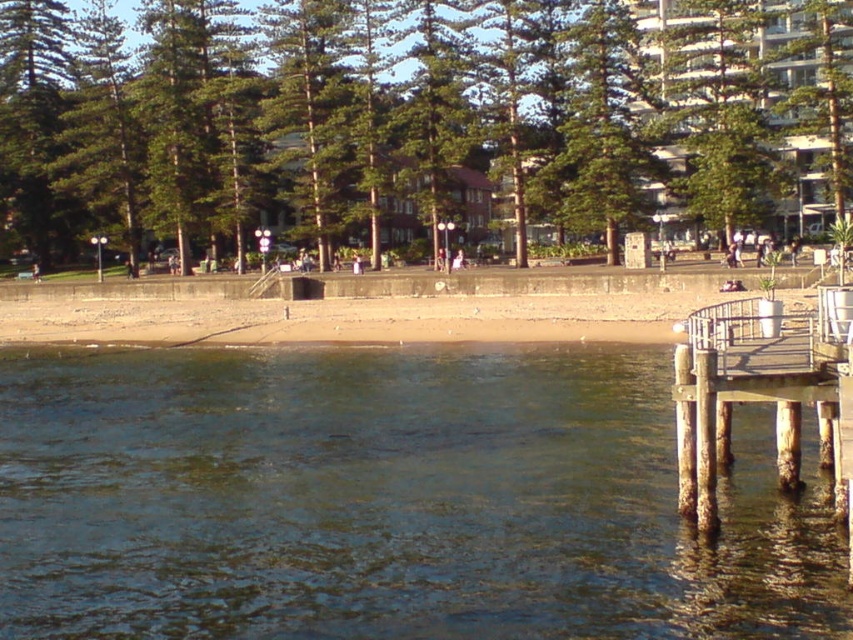
Is clear water at lower left to the right of rusty wood dock at lower right from the viewer's perspective?

In fact, clear water at lower left is to the left of rusty wood dock at lower right.

Who is positioned more to the left, clear water at lower left or rusty wood dock at lower right?

From the viewer's perspective, clear water at lower left appears more on the left side.

Between point (590, 419) and point (675, 385), which one is positioned behind?

Point (590, 419)

You are a GUI agent. You are given a task and a screenshot of the screen. Output one action in this format:
    pyautogui.click(x=<x>, y=<y>)
    Task: Click on the clear water at lower left
    This screenshot has height=640, width=853.
    Given the screenshot: What is the action you would take?
    pyautogui.click(x=389, y=500)

Between green leafy tree at center and rusty wood dock at lower right, which one appears on the left side from the viewer's perspective?

Positioned to the left is green leafy tree at center.

What do you see at coordinates (413, 118) in the screenshot?
I see `green leafy tree at center` at bounding box center [413, 118].

At what (x,y) coordinates should I click in order to perform the action: click on green leafy tree at center. Please return your answer as a coordinate pair (x, y). Image resolution: width=853 pixels, height=640 pixels. Looking at the image, I should click on (413, 118).

Who is taller, clear water at lower left or green leafy tree at center?

Standing taller between the two is green leafy tree at center.

Can you confirm if clear water at lower left is positioned to the left of green leafy tree at center?

No, clear water at lower left is not to the left of green leafy tree at center.

Where is `clear water at lower left`? The width and height of the screenshot is (853, 640). clear water at lower left is located at coordinates (389, 500).